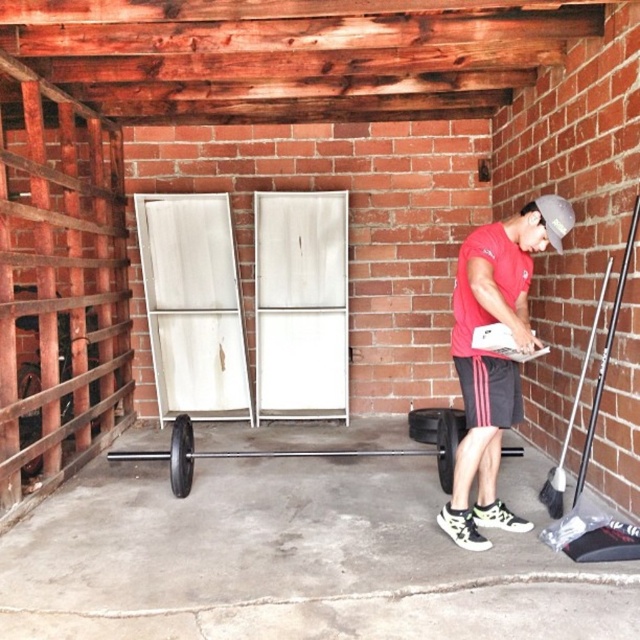
You are trying to fit both the black metal barbell at center and the black rubber wheel at lower center into a storage container that can only hold items with a combined width of 1.2 meters. If the barbell is wider than the wheel, what is the maximum possible width of the barbell so that both items can still fit together?

The black metal barbell at center is wider than the black rubber wheel at lower center. Let the width of the barbell be B and the wheel be W. We know B > W and B W < 1.2. To maximize B, we set W as small as possible. However, without knowing the minimum width of the wheel, we can only state that the barbell must be less than 1.2 meters. But since B > W, the maximum B would be just under 1.2 meters when W approaches zero, which isn

You are standing in the space and want to move from the black rubber wheel at lower left to the black rubber wheel at left. Which direction should you move to reach the other wheel?

To move from the black rubber wheel at lower left to the black rubber wheel at left, you should move to the left since the black rubber wheel at lower left is to the right of the black rubber wheel at left.

You are organizing a storage area and need to place the black metal barbell at center and the black rubber wheel at lower center. According to the image, which one is positioned to the left?

The black metal barbell at center is positioned to the left of the black rubber wheel at lower center.